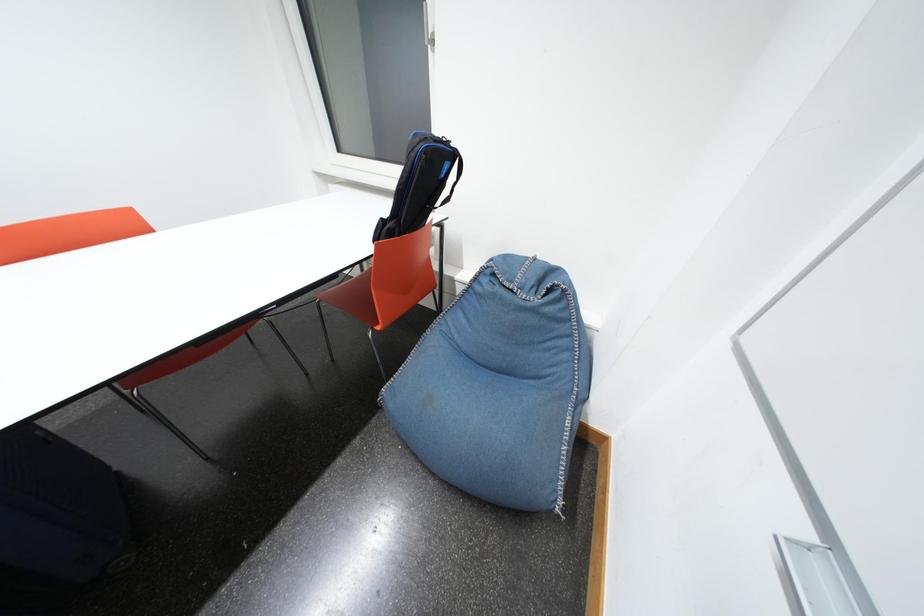
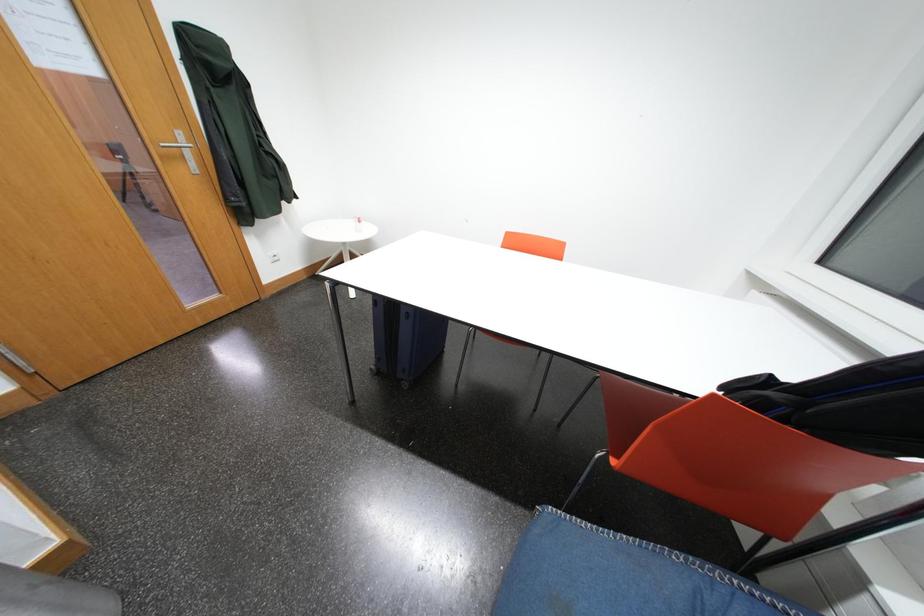
The images are taken continuously from a first-person perspective. In which direction is your viewpoint rotating?

The rotation direction of the camera is left-down.